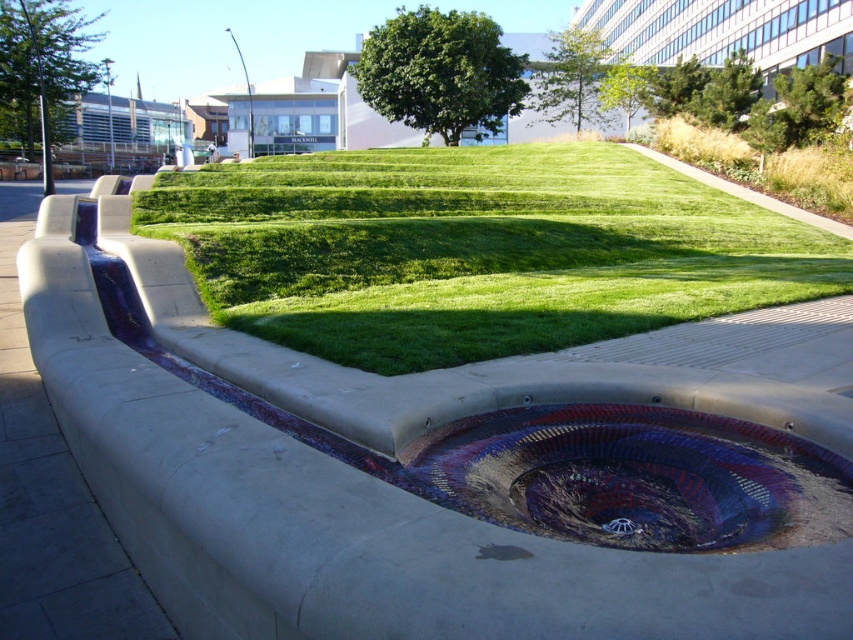
Is concrete at center below multicolored mosaic sink at center?

Correct, concrete at center is located below multicolored mosaic sink at center.

Does concrete at center lie behind multicolored mosaic sink at center?

That is False.

You are a GUI agent. You are given a task and a screenshot of the screen. Output one action in this format:
    pyautogui.click(x=<x>, y=<y>)
    Task: Click on the concrete at center
    The height and width of the screenshot is (640, 853).
    Given the screenshot: What is the action you would take?
    pyautogui.click(x=448, y=465)